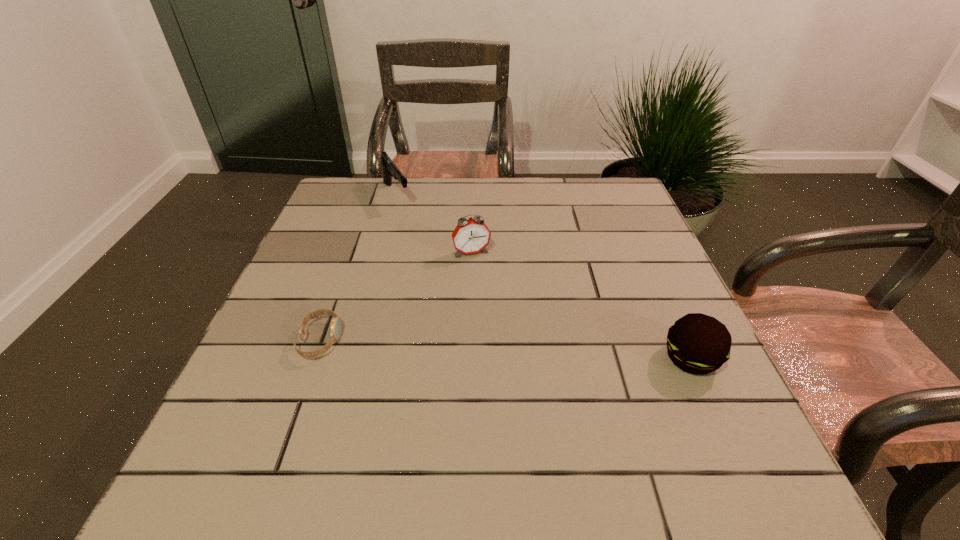
At what (x,y) coordinates should I click in order to perform the action: click on vacant space at the near edge of the desktop. Please return your answer as a coordinate pair (x, y). This screenshot has width=960, height=540. Looking at the image, I should click on (430, 440).

Locate an element on the screen. Image resolution: width=960 pixels, height=540 pixels. vacant region at the left edge of the desktop is located at coordinates (338, 241).

In the image, there is a desktop. Where is `free space at the right edge`? The height and width of the screenshot is (540, 960). free space at the right edge is located at coordinates (660, 319).

At what (x,y) coordinates should I click in order to perform the action: click on vacant region at the far left corner of the desktop. Please return your answer as a coordinate pair (x, y). Image resolution: width=960 pixels, height=540 pixels. Looking at the image, I should click on coord(332,198).

What are the coordinates of `vacant region at the near left corner of the desktop` in the screenshot? It's located at pyautogui.click(x=232, y=422).

Where is `free space at the far right corner of the desktop`? This screenshot has height=540, width=960. free space at the far right corner of the desktop is located at coordinates coord(631,202).

Where is `vacant space in between the gun and the watch`? vacant space in between the gun and the watch is located at coordinates pyautogui.click(x=358, y=267).

This screenshot has width=960, height=540. I want to click on vacant area between the third nearest object and the shortest object, so point(396,296).

The image size is (960, 540). Identify the location of vacant space that is in between the rightmost object and the gun. (544, 276).

Find the location of a particular element. This screenshot has width=960, height=540. vacant region between the gun and the watch is located at coordinates (358, 267).